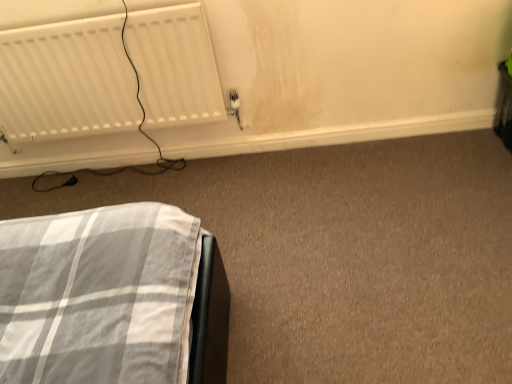
Identify the location of free point above white matte radiator at upper left (from a real-world perspective). (101, 9).